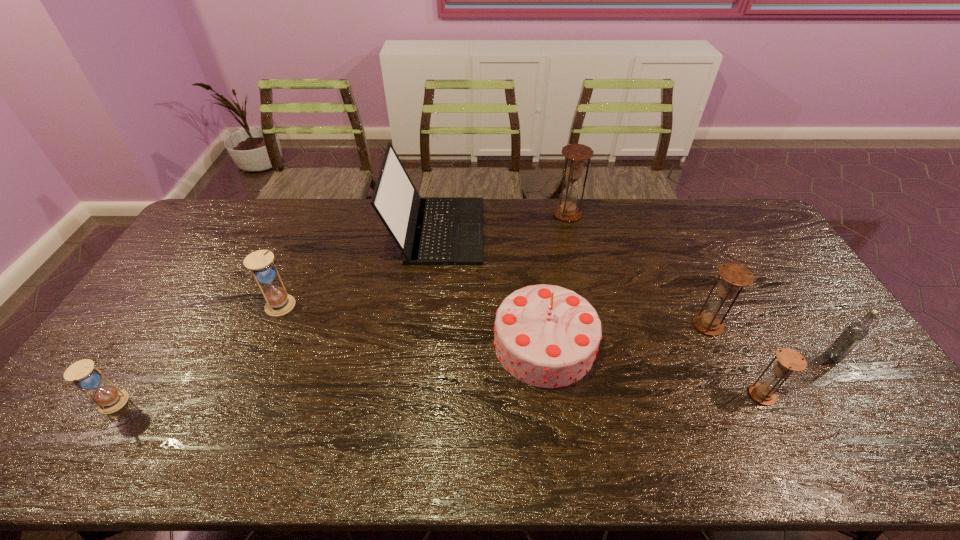
Identify the location of hourglass that is at the far edge. The width and height of the screenshot is (960, 540). 576,154.

At what (x,y) coordinates should I click in order to perform the action: click on laptop situated at the far edge. Please return your answer as a coordinate pair (x, y). Looking at the image, I should click on (428, 230).

The image size is (960, 540). In order to click on object that is positioned at the left edge in this screenshot , I will do `click(82, 374)`.

Where is `object at the right edge`? This screenshot has height=540, width=960. object at the right edge is located at coordinates (855, 332).

What are the coordinates of `vacant space at the far edge of the desktop` in the screenshot? It's located at (358, 236).

Identify the location of vacant area at the near edge of the desktop. (513, 445).

At what (x,y) coordinates should I click in order to perform the action: click on free space at the left edge. Please return your answer as a coordinate pair (x, y). The image size is (960, 540). Looking at the image, I should click on (210, 280).

What are the coordinates of `free region at the far left corner of the desktop` in the screenshot? It's located at (250, 213).

In the image, there is a desktop. Where is `free region at the near left corner`? free region at the near left corner is located at coordinates (51, 467).

This screenshot has height=540, width=960. In the image, there is a desktop. Find the location of `vacant space at the far right corner`. vacant space at the far right corner is located at coordinates (725, 222).